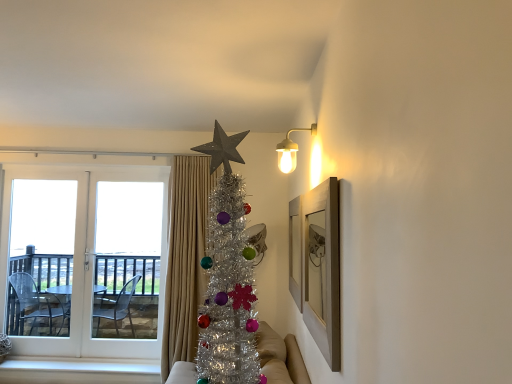
Image resolution: width=512 pixels, height=384 pixels. Identify the location of free point above white glass door at left, which ranks as the second screen door in left-to-right order (from a real-world perspective). (120, 173).